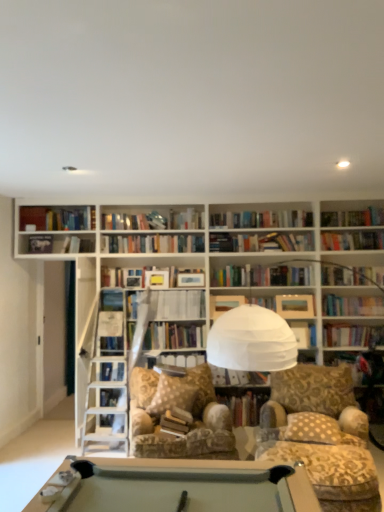
Locate an element on the screen. The height and width of the screenshot is (512, 384). free spot above patterned fabric chair at center (from a real-world perspective) is located at coordinates (314, 449).